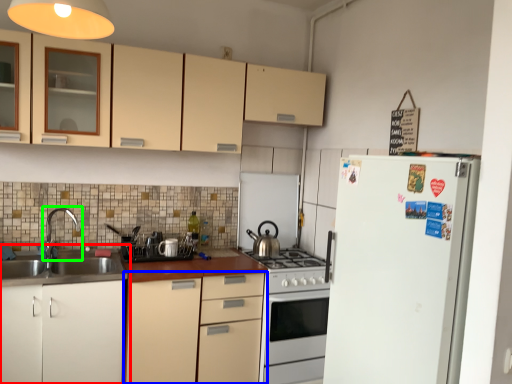
Question: Which is nearer to the cabinetry (highlighted by a red box)? cabinetry (highlighted by a blue box) or tap (highlighted by a green box).

Choices:
 (A) cabinetry
 (B) tap

Answer: (A)